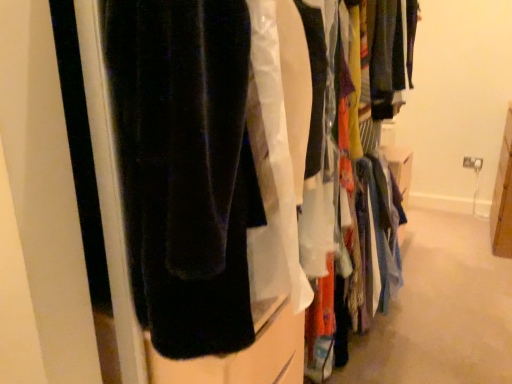
Describe the element at coordinates (213, 182) in the screenshot. The height and width of the screenshot is (384, 512). I see `velvet black pants at left, which is counted as the first closet, starting from the left` at that location.

This screenshot has width=512, height=384. In order to click on velvet black pants at left, marked as the second closet in a right-to-left arrangement in this screenshot , I will do (213, 182).

How much space does velvet black pants at left, which is counted as the first closet, starting from the left, occupy vertically?

The height of velvet black pants at left, which is counted as the first closet, starting from the left, is 1.78 meters.

Measure the distance between velvet black pants at left, marked as the second closet in a right-to-left arrangement, and camera.

A distance of 23.96 inches exists between velvet black pants at left, marked as the second closet in a right-to-left arrangement, and camera.

What is the approximate height of light blue fabric at center, which is the 2th closet from left to right?

It is 38.52 inches.

At what (x,y) coordinates should I click in order to perform the action: click on light blue fabric at center, acting as the first closet starting from the right. Please return your answer as a coordinate pair (x, y). The width and height of the screenshot is (512, 384). Looking at the image, I should click on (346, 186).

Measure the distance between light blue fabric at center, which is the 2th closet from left to right, and camera.

light blue fabric at center, which is the 2th closet from left to right, is 35.11 inches from camera.

This screenshot has height=384, width=512. What do you see at coordinates (346, 186) in the screenshot? I see `light blue fabric at center, acting as the first closet starting from the right` at bounding box center [346, 186].

Locate an element on the screen. Image resolution: width=512 pixels, height=384 pixels. velvet black pants at left, marked as the second closet in a right-to-left arrangement is located at coordinates (213, 182).

Considering the positions of objects velvet black pants at left, which is counted as the first closet, starting from the left, and light blue fabric at center, which is the 2th closet from left to right, in the image provided, who is more to the right, velvet black pants at left, which is counted as the first closet, starting from the left, or light blue fabric at center, which is the 2th closet from left to right,?

light blue fabric at center, which is the 2th closet from left to right.

Which object is more forward, velvet black pants at left, marked as the second closet in a right-to-left arrangement, or light blue fabric at center, which is the 2th closet from left to right?

velvet black pants at left, marked as the second closet in a right-to-left arrangement, is more forward.

Which is less distant, (259, 199) or (358, 245)?

Positioned in front is point (259, 199).

From the image's perspective, is velvet black pants at left, which is counted as the first closet, starting from the left, positioned above or below light blue fabric at center, acting as the first closet starting from the right?

Based on their image positions, velvet black pants at left, which is counted as the first closet, starting from the left, is located above light blue fabric at center, acting as the first closet starting from the right.

From a real-world perspective, is velvet black pants at left, which is counted as the first closet, starting from the left, positioned under light blue fabric at center, which is the 2th closet from left to right, based on gravity?

No, from a real-world perspective, velvet black pants at left, which is counted as the first closet, starting from the left, is not beneath light blue fabric at center, which is the 2th closet from left to right.

Which of these two, velvet black pants at left, marked as the second closet in a right-to-left arrangement, or light blue fabric at center, acting as the first closet starting from the right, is thinner?

Thinner between the two is light blue fabric at center, acting as the first closet starting from the right.

Who is shorter, velvet black pants at left, marked as the second closet in a right-to-left arrangement, or light blue fabric at center, which is the 2th closet from left to right?

light blue fabric at center, which is the 2th closet from left to right, is shorter.

Is velvet black pants at left, which is counted as the first closet, starting from the left, bigger or smaller than light blue fabric at center, which is the 2th closet from left to right?

Considering their sizes, velvet black pants at left, which is counted as the first closet, starting from the left, takes up more space than light blue fabric at center, which is the 2th closet from left to right.

Consider the image. Is velvet black pants at left, marked as the second closet in a right-to-left arrangement, outside of light blue fabric at center, acting as the first closet starting from the right?

Yes, velvet black pants at left, marked as the second closet in a right-to-left arrangement, is not within light blue fabric at center, acting as the first closet starting from the right.

Is velvet black pants at left, marked as the second closet in a right-to-left arrangement, far from light blue fabric at center, acting as the first closet starting from the right?

No, velvet black pants at left, marked as the second closet in a right-to-left arrangement, is not far away from light blue fabric at center, acting as the first closet starting from the right.

Is velvet black pants at left, which is counted as the first closet, starting from the left, facing away from light blue fabric at center, acting as the first closet starting from the right?

Yes, velvet black pants at left, which is counted as the first closet, starting from the left, is positioned with its back facing light blue fabric at center, acting as the first closet starting from the right.

The image size is (512, 384). In order to click on closet below the velvet black pants at left, marked as the second closet in a right-to-left arrangement (from the image's perspective) in this screenshot , I will do `click(346, 186)`.

Considering the relative positions of light blue fabric at center, acting as the first closet starting from the right, and velvet black pants at left, marked as the second closet in a right-to-left arrangement, in the image provided, is light blue fabric at center, acting as the first closet starting from the right, to the left or to the right of velvet black pants at left, marked as the second closet in a right-to-left arrangement,?

Clearly, light blue fabric at center, acting as the first closet starting from the right, is on the right of velvet black pants at left, marked as the second closet in a right-to-left arrangement, in the image.

Is light blue fabric at center, which is the 2th closet from left to right, further to the viewer compared to velvet black pants at left, which is counted as the first closet, starting from the left?

That is True.

Does point (311, 73) come in front of point (263, 162)?

That is False.

From the image's perspective, is light blue fabric at center, which is the 2th closet from left to right, located above or below velvet black pants at left, which is counted as the first closet, starting from the left?

light blue fabric at center, which is the 2th closet from left to right, is below velvet black pants at left, which is counted as the first closet, starting from the left.

From a real-world perspective, which object rests below the other?

In real-world perspective, light blue fabric at center, acting as the first closet starting from the right, is lower.

Considering the sizes of objects light blue fabric at center, acting as the first closet starting from the right, and velvet black pants at left, marked as the second closet in a right-to-left arrangement, in the image provided, who is wider, light blue fabric at center, acting as the first closet starting from the right, or velvet black pants at left, marked as the second closet in a right-to-left arrangement,?

Wider between the two is velvet black pants at left, marked as the second closet in a right-to-left arrangement.

Considering the relative sizes of light blue fabric at center, which is the 2th closet from left to right, and velvet black pants at left, marked as the second closet in a right-to-left arrangement, in the image provided, is light blue fabric at center, which is the 2th closet from left to right, taller than velvet black pants at left, marked as the second closet in a right-to-left arrangement,?

No.

Which of these two, light blue fabric at center, which is the 2th closet from left to right, or velvet black pants at left, marked as the second closet in a right-to-left arrangement, is bigger?

Bigger between the two is velvet black pants at left, marked as the second closet in a right-to-left arrangement.

Is light blue fabric at center, which is the 2th closet from left to right, inside the boundaries of velvet black pants at left, which is counted as the first closet, starting from the left, or outside?

light blue fabric at center, which is the 2th closet from left to right, fits inside velvet black pants at left, which is counted as the first closet, starting from the left.

Are light blue fabric at center, acting as the first closet starting from the right, and velvet black pants at left, marked as the second closet in a right-to-left arrangement, far apart?

light blue fabric at center, acting as the first closet starting from the right, is actually quite close to velvet black pants at left, marked as the second closet in a right-to-left arrangement.

From the picture: Is light blue fabric at center, acting as the first closet starting from the right, facing away from velvet black pants at left, marked as the second closet in a right-to-left arrangement?

That's right, light blue fabric at center, acting as the first closet starting from the right, is facing away from velvet black pants at left, marked as the second closet in a right-to-left arrangement.

Where is `closet that is behind the velvet black pants at left, which is counted as the first closet, starting from the left`? Image resolution: width=512 pixels, height=384 pixels. closet that is behind the velvet black pants at left, which is counted as the first closet, starting from the left is located at coordinates (346, 186).

Locate an element on the screen. closet positioned vertically above the light blue fabric at center, acting as the first closet starting from the right (from a real-world perspective) is located at coordinates (213, 182).

Where is `closet below the velvet black pants at left, which is counted as the first closet, starting from the left (from the image's perspective)`? The width and height of the screenshot is (512, 384). closet below the velvet black pants at left, which is counted as the first closet, starting from the left (from the image's perspective) is located at coordinates (346, 186).